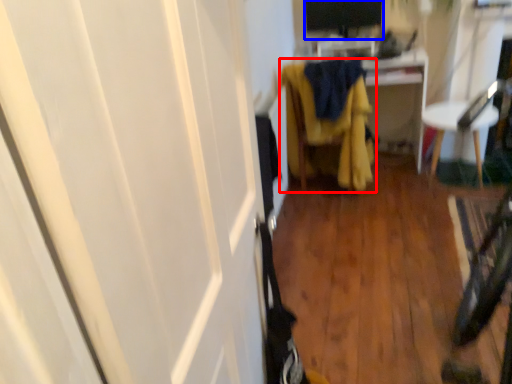
Question: Which point is further to the camera, furniture (highlighted by a red box) or computer monitor (highlighted by a blue box)?

Choices:
 (A) furniture
 (B) computer monitor

Answer: (B)